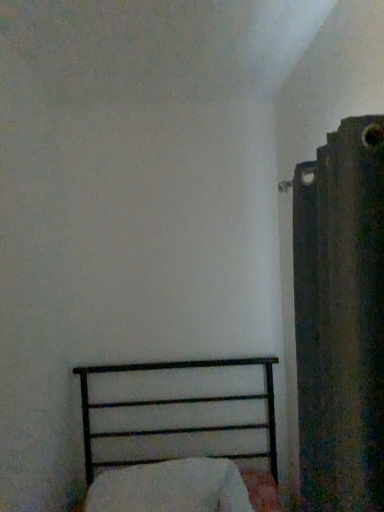
Question: Is black metal bed at lower left in contact with white soft pillow at lower center?

Choices:
 (A) yes
 (B) no

Answer: (B)

Question: Can you confirm if black metal bed at lower left is bigger than white soft pillow at lower center?

Choices:
 (A) no
 (B) yes

Answer: (B)

Question: From a real-world perspective, is black metal bed at lower left physically above white soft pillow at lower center?

Choices:
 (A) yes
 (B) no

Answer: (A)

Question: Is black metal bed at lower left thinner than white soft pillow at lower center?

Choices:
 (A) no
 (B) yes

Answer: (A)

Question: From the image's perspective, is black metal bed at lower left under white soft pillow at lower center?

Choices:
 (A) yes
 (B) no

Answer: (B)

Question: Is black metal bed at lower left to the left of white soft pillow at lower center from the viewer's perspective?

Choices:
 (A) yes
 (B) no

Answer: (B)

Question: Is dark textured fabric at right oriented towards white soft pillow at lower center?

Choices:
 (A) yes
 (B) no

Answer: (A)

Question: Is the depth of dark textured fabric at right less than that of white soft pillow at lower center?

Choices:
 (A) no
 (B) yes

Answer: (B)

Question: From the image's perspective, is dark textured fabric at right located above white soft pillow at lower center?

Choices:
 (A) no
 (B) yes

Answer: (B)

Question: From a real-world perspective, does dark textured fabric at right stand above white soft pillow at lower center?

Choices:
 (A) no
 (B) yes

Answer: (B)

Question: Does dark textured fabric at right appear on the right side of white soft pillow at lower center?

Choices:
 (A) no
 (B) yes

Answer: (B)

Question: Can you confirm if dark textured fabric at right is bigger than white soft pillow at lower center?

Choices:
 (A) no
 (B) yes

Answer: (B)

Question: Can you confirm if white soft pillow at lower center is bigger than dark textured fabric at right?

Choices:
 (A) no
 (B) yes

Answer: (A)